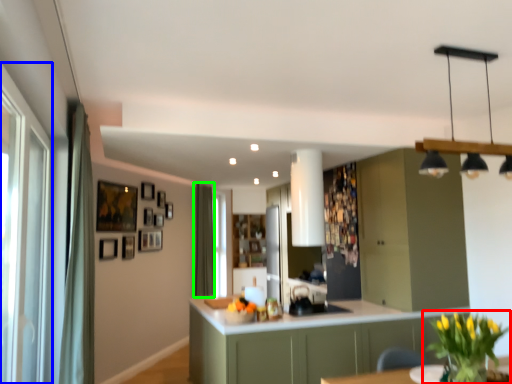
Question: Considering the real-world distances, which object is closest to houseplant (highlighted by a red box)? glass door (highlighted by a blue box) or curtain (highlighted by a green box).

Choices:
 (A) glass door
 (B) curtain

Answer: (A)